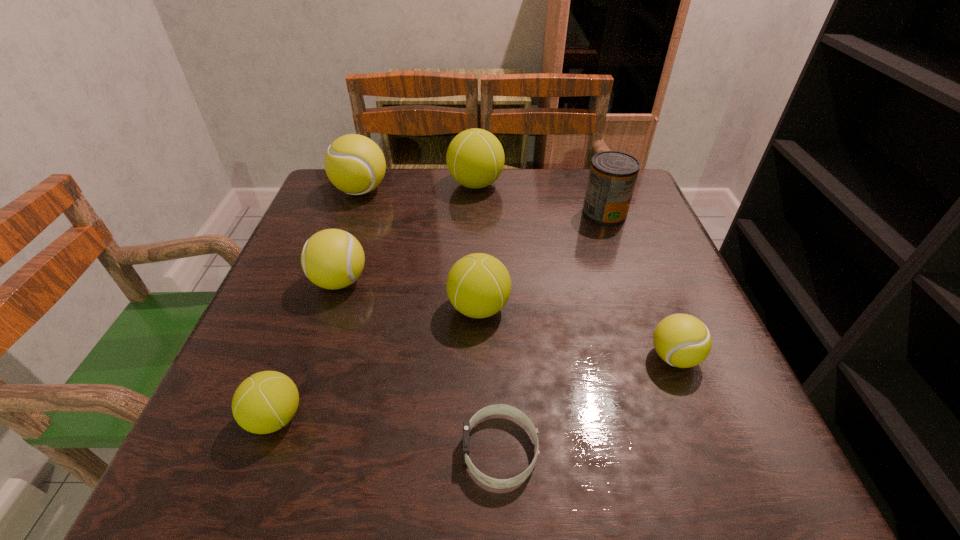
Locate an element on the screen. The width and height of the screenshot is (960, 540). vacant area situated on the right of the biggest yellow tennis ball is located at coordinates (462, 191).

Find the location of `vacant point located 0.380m on the front of the farthest green tennis ball`. vacant point located 0.380m on the front of the farthest green tennis ball is located at coordinates (474, 308).

Where is `blank space located on the front of the red can`? blank space located on the front of the red can is located at coordinates (614, 242).

The width and height of the screenshot is (960, 540). In order to click on vacant space situated on the back of the second farthest yellow tennis ball in this screenshot , I will do `click(376, 173)`.

Find the location of a particular element. vacant space located on the left of the second nearest green tennis ball is located at coordinates (303, 308).

This screenshot has height=540, width=960. I want to click on vacant position located on the left of the rightmost yellow tennis ball, so click(505, 357).

At what (x,y) coordinates should I click in order to perform the action: click on free space located 0.380m on the back of the leftmost green tennis ball. Please return your answer as a coordinate pair (x, y). The height and width of the screenshot is (540, 960). Looking at the image, I should click on (339, 246).

Locate an element on the screen. free space located 0.240m on the outer surface of the shortest object is located at coordinates (300, 451).

Identify the location of vacant region located 0.320m on the outer surface of the shortest object. Image resolution: width=960 pixels, height=540 pixels. (245, 451).

Identify the location of vacant space located on the outer surface of the shortest object. The width and height of the screenshot is (960, 540). (409, 451).